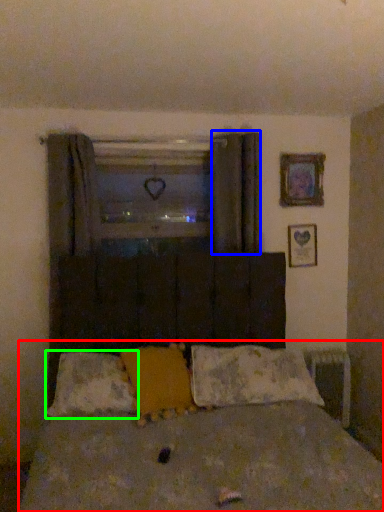
Question: Based on their relative distances, which object is nearer to bed (highlighted by a red box)? Choose from curtain (highlighted by a blue box) and pillow (highlighted by a green box).

Choices:
 (A) curtain
 (B) pillow

Answer: (B)